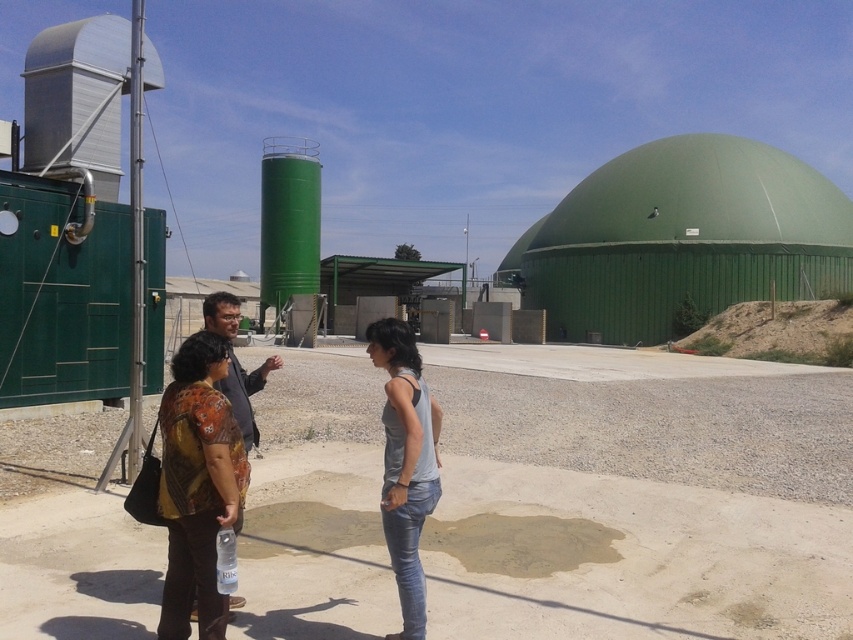
You are standing at the point marked as point (196, 484) in the image. What object are you touching?

The point (196, 484) is on printed fabric shirt at lower left, so you are touching the printed fabric shirt at lower left.

You are a photographer trying to capture a group photo of the two people in the scene. You notice the printed fabric shirt at lower left and the gray matte tank top at center. Which person should you ask to stand on a stool to ensure both are visible in the photo?

The printed fabric shirt at lower left has a lesser height compared to gray matte tank top at center, so you should ask the person wearing the printed fabric shirt at lower left to stand on a stool to ensure both are visible in the photo.